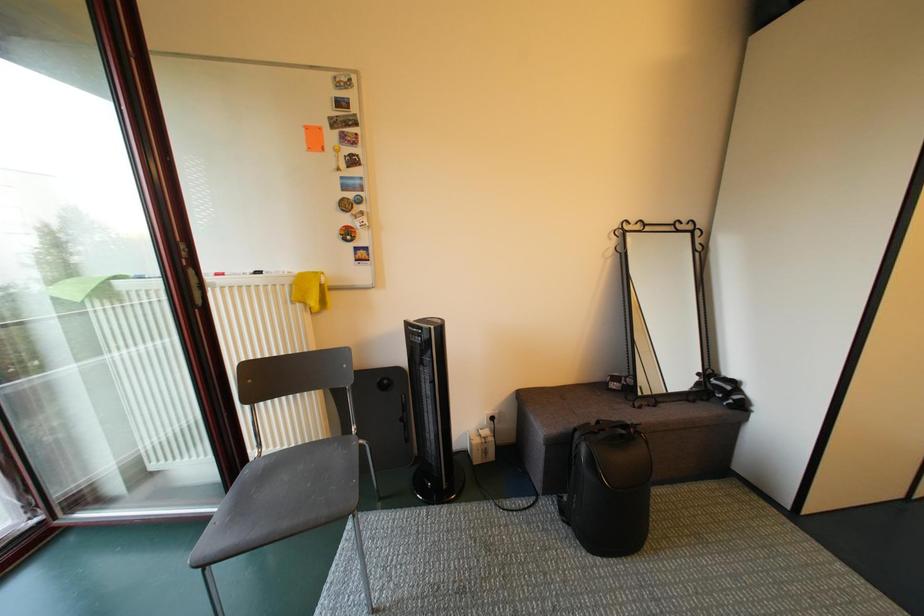
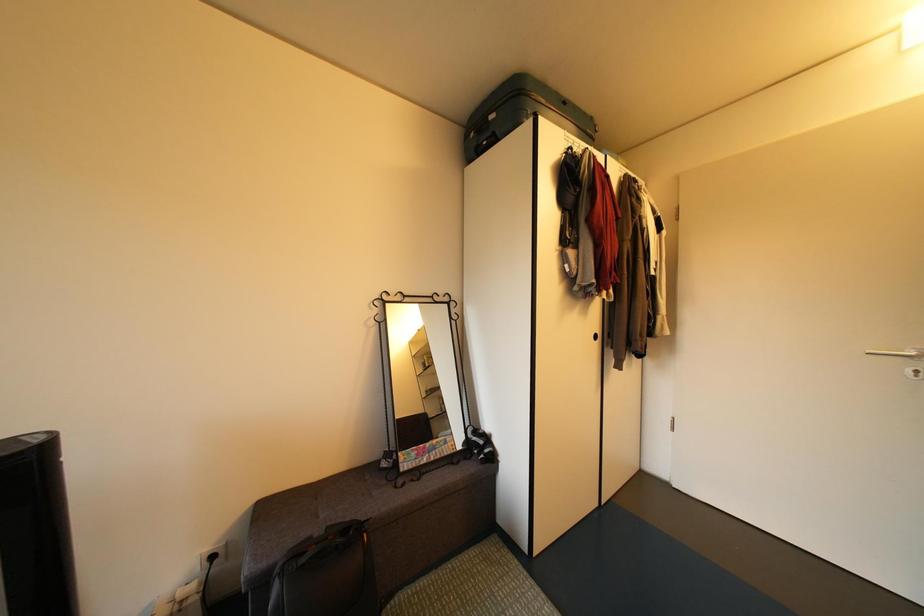
Question: The camera is either moving clockwise (left) or counter-clockwise (right) around the object. The first image is from the beginning of the video and the second image is from the end. Is the camera moving left or right when shooting the video?

Choices:
 (A) Left
 (B) Right

Answer: (A)